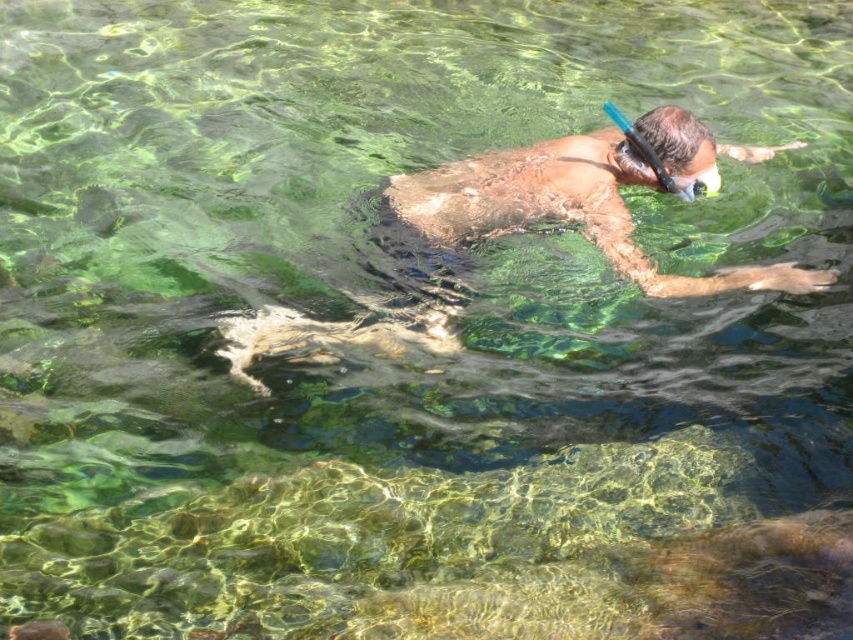
You are a lifeguard observing the scene from the beach. You see the smooth skin diver at center and the blue rubber snorkel at upper center. Which object is closer to you, the lifeguard?

The smooth skin diver at center is closer to you because they are in front of the blue rubber snorkel at upper center.

You are a marine biologist observing the snorkeling scene. You need to place a protective cover over the wider object between the smooth skin diver at center and the blue rubber snorkel at upper center. Which object should you cover?

The smooth skin diver at center should be covered because its width is larger than the blue rubber snorkel at upper center.

Looking at this image, you are standing on a boat 4 meters away from the water surface. You see the smooth skin diver at center. Can you reach the diver with a 4.07 meter long fishing rod?

The smooth skin diver at center is 4.07 meters away from viewer. Since the fishing rod is exactly 4.07 meters long, you can just barely reach the diver with the fishing rod.